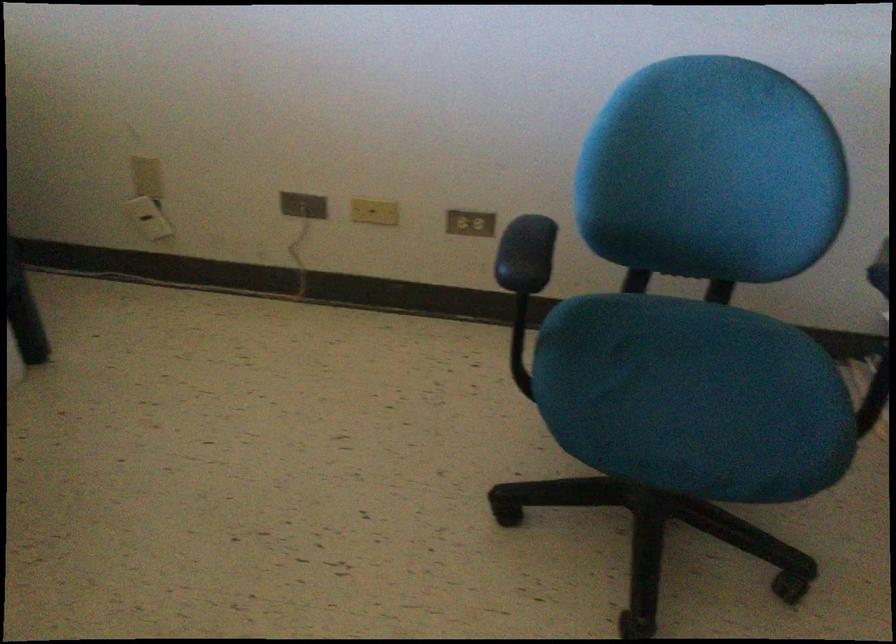
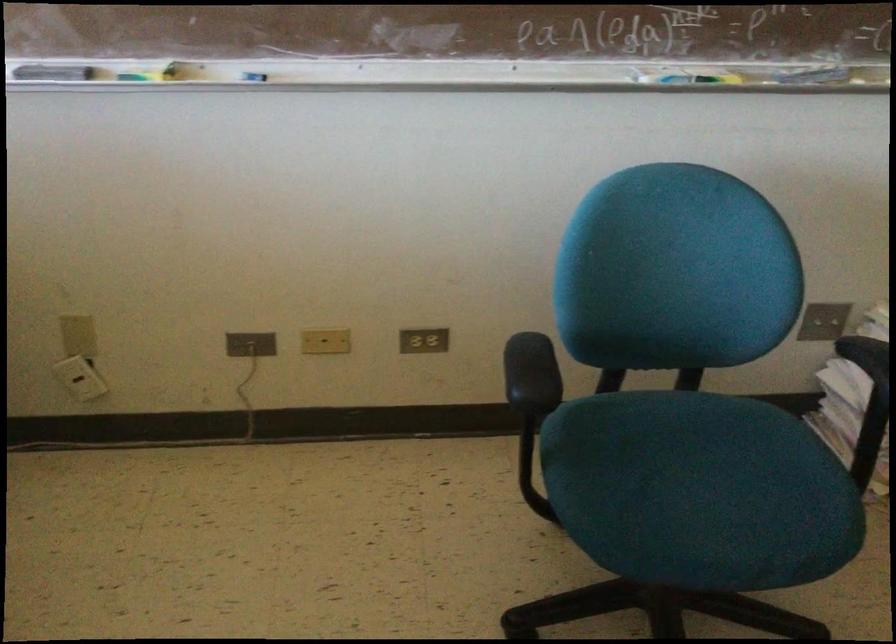
Question: In a continuous first-person perspective shot, in which direction is the camera moving?

Choices:
 (A) Left
 (B) Right
 (C) Forward
 (D) Backward

Answer: (A)